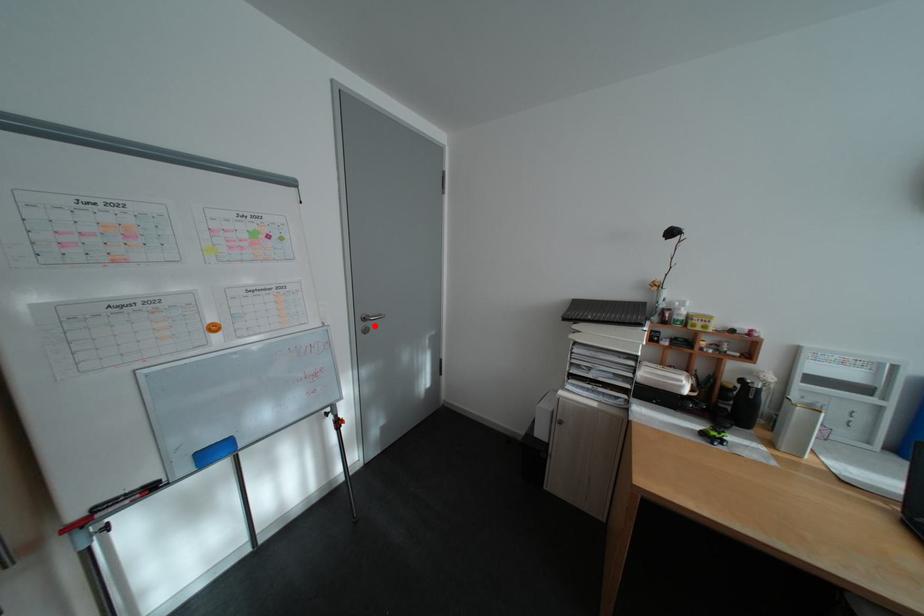
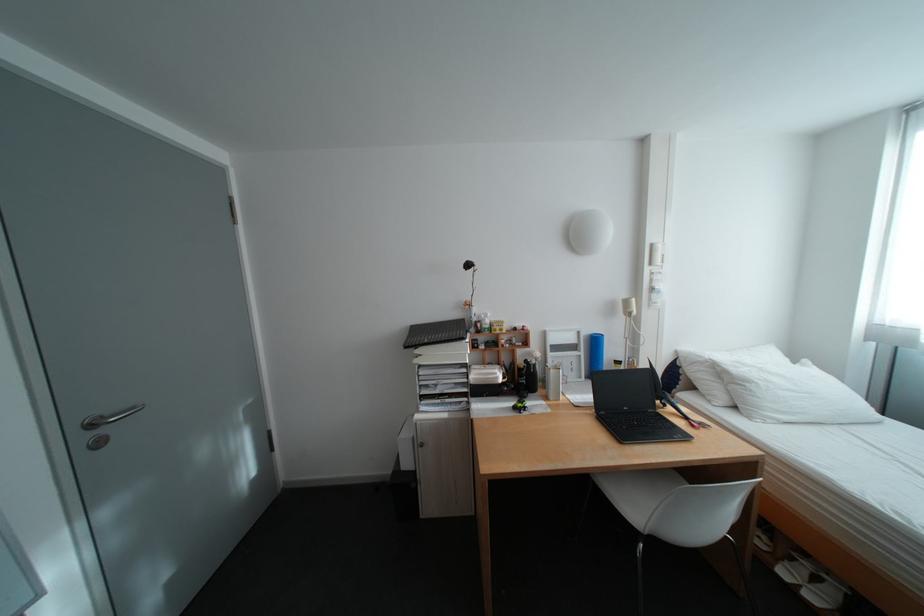
Where in the second image is the point corresponding to the highlighted location from the first image?

(99, 438)